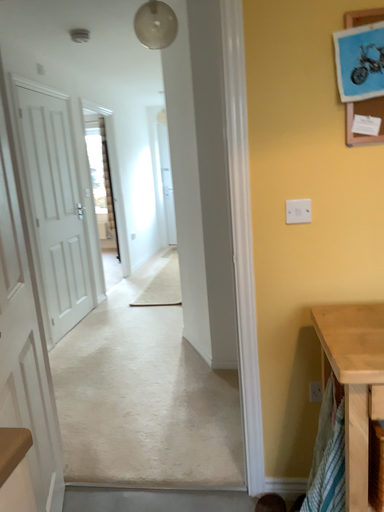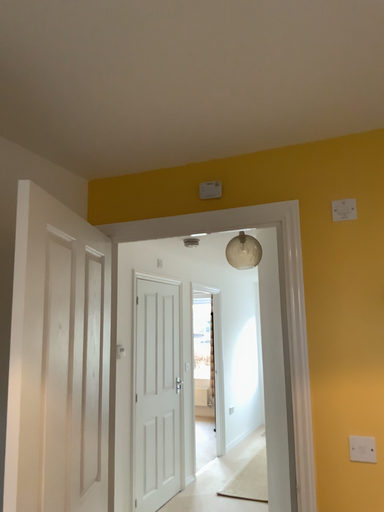
Question: How did the camera likely rotate when shooting the video?

Choices:
 (A) rotated downward
 (B) rotated upward

Answer: (B)